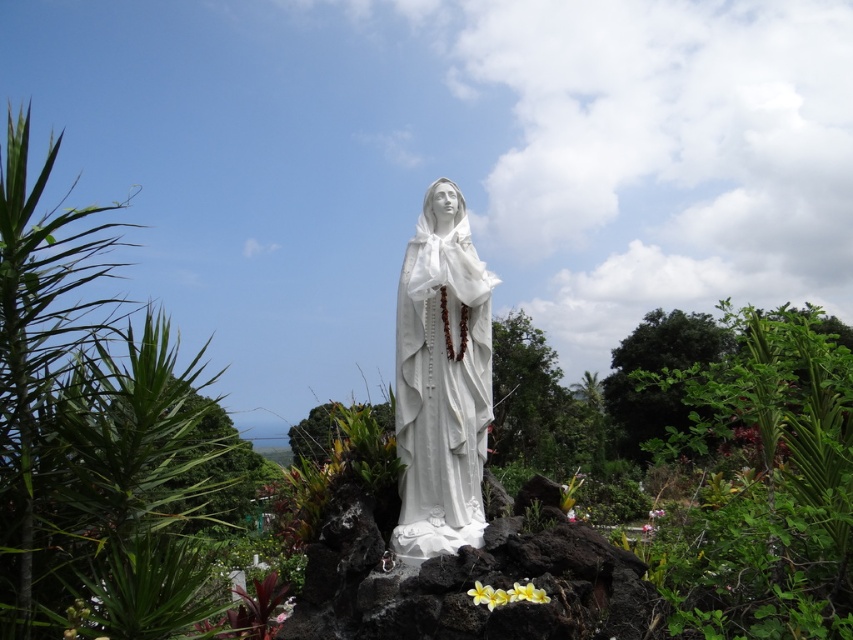
You are an artist planning to sketch the scene. You want to position the white marble statue at center in your drawing such that its center aligns with the rule of thirds grid. Given the rule of thirds divides the canvas into a 3x3 grid, can you determine if the statue is already positioned at one of the intersection points according to its current coordinates?

The rule of thirds grid has intersection points at approximately 1333x889 pixels. The white marble statue at center is located at coordinates (440, 381), which corresponds to the center of the canvas. Since the rule of thirds intersection points are offset from the center, the statue is not positioned at any of the rule of thirds intersection points.

You are standing at the center of the image and want to place a small decorative stone exactly at the location of the green leafy plant at center right. What are the coordinates where you should place the stone?

The coordinates for the green leafy plant at center right are at point (764, 480), so you should place the stone there.

You are a gardener planning to water the yellow matte flower at lower center. The statue is in your way. Can you reach the flower without moving the white marble statue at center?

The white marble statue at center is positioned over the yellow matte flower at lower center, so the statue is blocking direct access to the flower. You would need to move the statue or find another path around it to reach the flower.